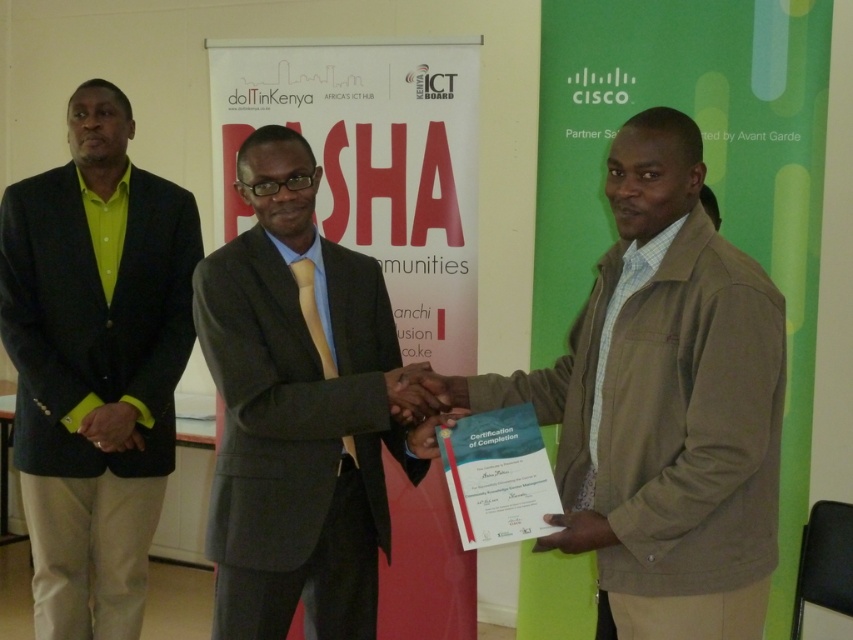
Question: Which object is closer to the camera taking this photo?

Choices:
 (A) dark gray suit at center
 (B) brown textured jacket at center
 (C) green matte blazer at left

Answer: (B)

Question: Estimate the real-world distances between objects in this image. Which object is farther from the brown textured jacket at center?

Choices:
 (A) green matte blazer at left
 (B) dark gray suit at center

Answer: (A)

Question: Can you confirm if dark gray suit at center is positioned to the left of green matte blazer at left?

Choices:
 (A) yes
 (B) no

Answer: (B)

Question: Is brown textured jacket at center wider than green matte blazer at left?

Choices:
 (A) no
 (B) yes

Answer: (B)

Question: Which object is positioned farthest from the green matte blazer at left?

Choices:
 (A) dark gray suit at center
 (B) brown textured jacket at center

Answer: (B)

Question: Observing the image, what is the correct spatial positioning of brown textured jacket at center in reference to green matte blazer at left?

Choices:
 (A) below
 (B) above

Answer: (B)